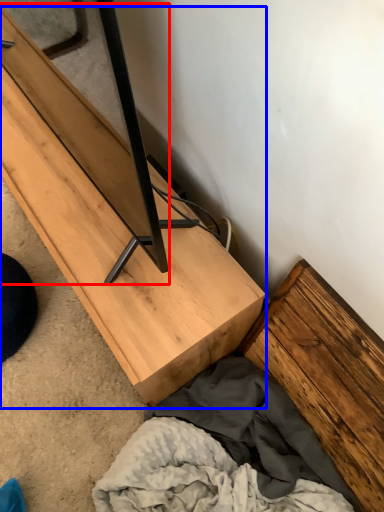
Question: Which of the following is the farthest to the observer, plank (highlighted by a red box) or furniture (highlighted by a blue box)?

Choices:
 (A) plank
 (B) furniture

Answer: (B)